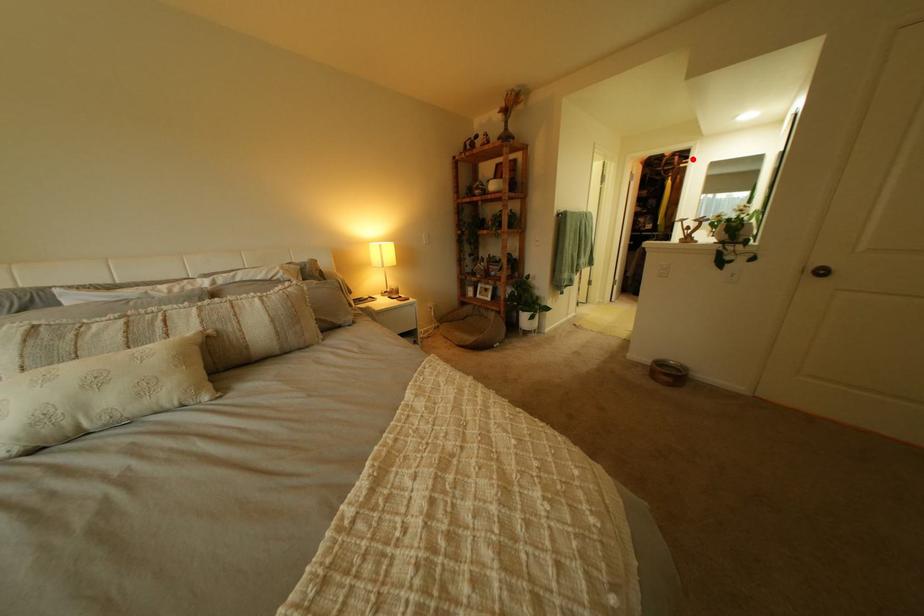
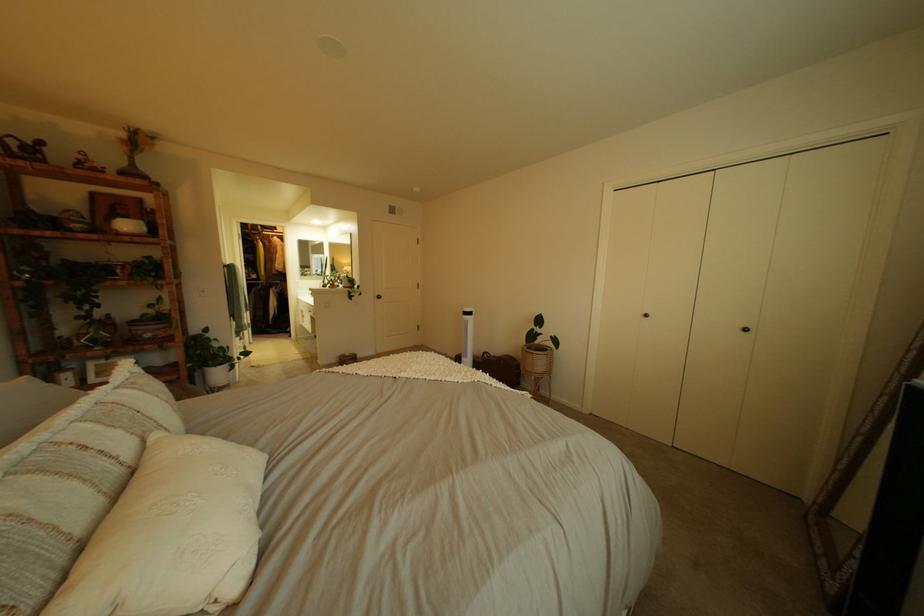
The point at the highlighted location is marked in the first image. Where is the corresponding point in the second image?

(274, 228)